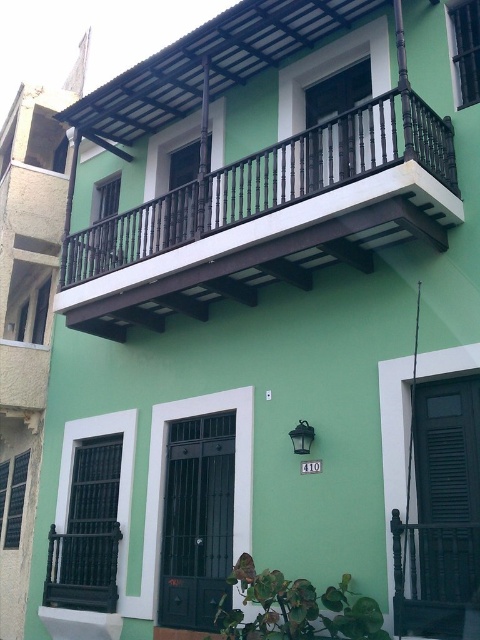
Who is positioned more to the left, black metal/brown wood at lower left or black metal shutter at lower left?

black metal shutter at lower left is more to the left.

Is black metal/brown wood at lower left above black metal shutter at lower left?

Actually, black metal/brown wood at lower left is below black metal shutter at lower left.

I want to click on black metal/brown wood at lower left, so click(82, 570).

The height and width of the screenshot is (640, 480). I want to click on black metal/brown wood at lower left, so click(x=82, y=570).

Is point (194, 540) positioned after point (100, 182)?

No, it is in front of (100, 182).

Consider the image. Does black metal/glass door at center appear on the left side of black metal/brown wood at upper center?

In fact, black metal/glass door at center is to the right of black metal/brown wood at upper center.

Where is `black metal/glass door at center`? The height and width of the screenshot is (640, 480). black metal/glass door at center is located at coordinates (196, 520).

Is black metal/brown wood at lower left taller than green matte shutter at upper right?

Yes.

The image size is (480, 640). Find the location of `black metal/brown wood at lower left`. black metal/brown wood at lower left is located at coordinates (82, 570).